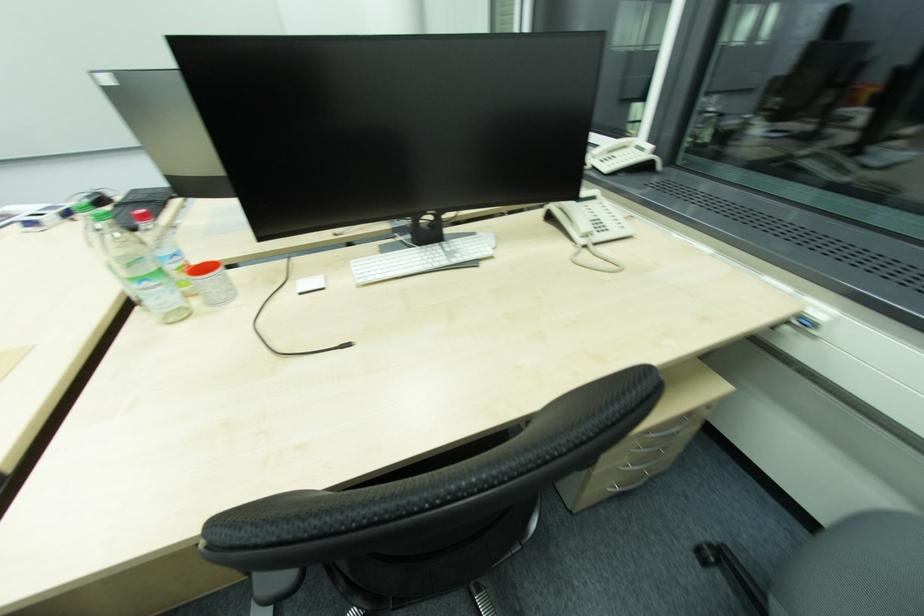
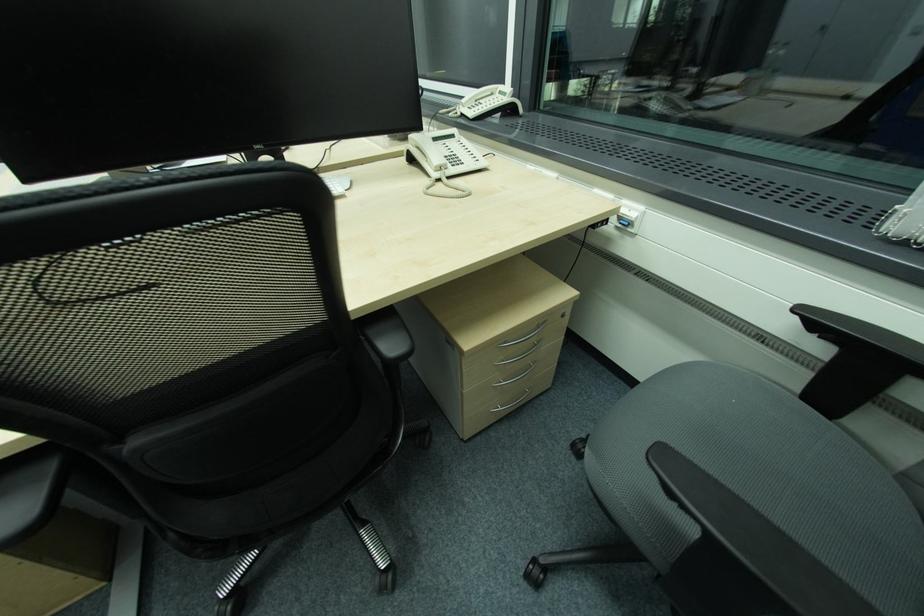
Locate, in the second image, the point that corresponds to the point at 813,323 in the first image.

(631, 225)